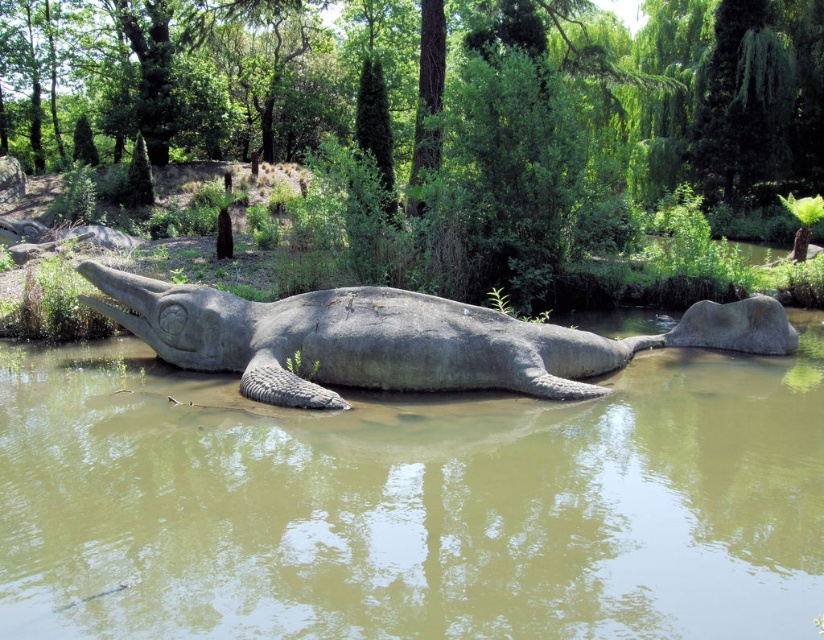
Question: Does brown matte water at center come behind gray stone crocodile at center?

Choices:
 (A) yes
 (B) no

Answer: (B)

Question: Is brown matte water at center bigger than gray stone crocodile at center?

Choices:
 (A) yes
 (B) no

Answer: (A)

Question: Which point is closer to the camera?

Choices:
 (A) (434, 323)
 (B) (233, 609)

Answer: (B)

Question: Is brown matte water at center to the right of gray stone crocodile at center from the viewer's perspective?

Choices:
 (A) no
 (B) yes

Answer: (B)

Question: Among these points, which one is farthest from the camera?

Choices:
 (A) (312, 636)
 (B) (162, 305)

Answer: (B)